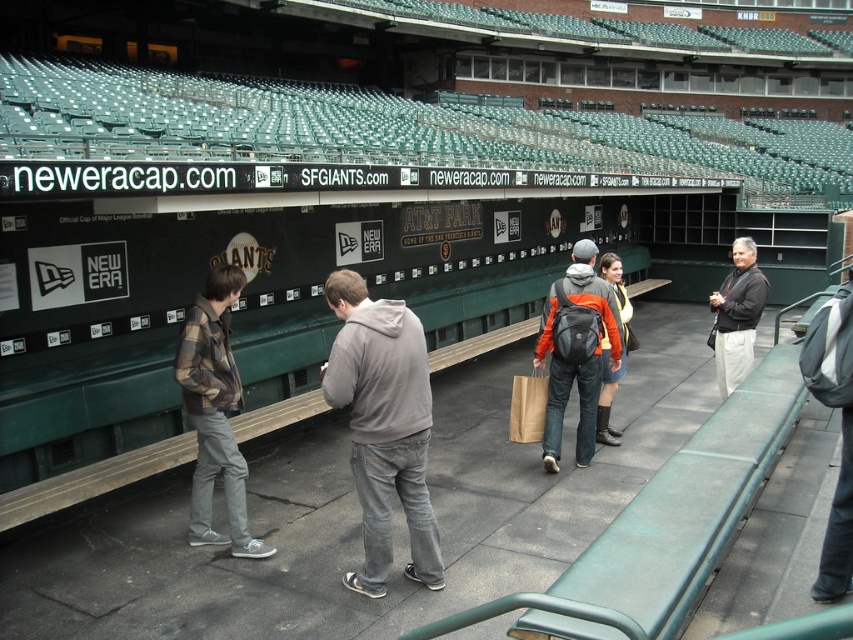
You are standing at the entrance of the stadium and want to take a photo of the point at coordinates point (454, 237). The camera you are using has a maximum focus range of 35 feet. Will the camera be able to focus on the point?

The distance of point (454, 237) from the camera is 38.40 feet, which exceeds the camera maximum focus range of 35 feet. Therefore, the camera will not be able to focus on the point.

Looking at this image, you are a visitor at AT T Park and want to take a photo of the orange fleece jacket at center while standing on the green plastic bleachers at upper center. Will the bleachers block your view of the jacket?

The green plastic bleachers at upper center are taller than the orange fleece jacket at center, so standing on them would likely block your view of the jacket since the bleachers are higher up.